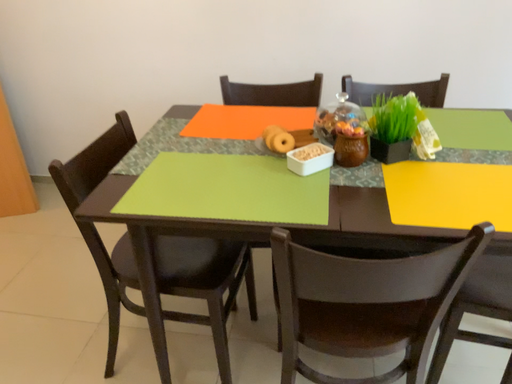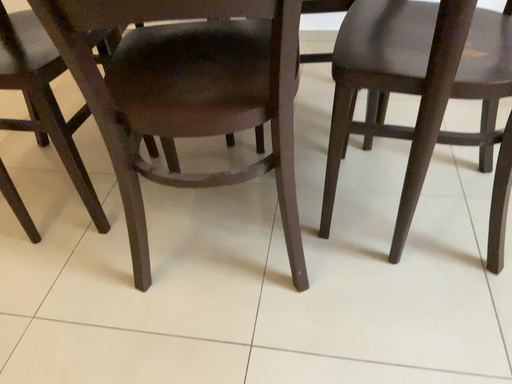
Question: How did the camera likely rotate when shooting the video?

Choices:
 (A) rotated upward
 (B) rotated downward

Answer: (B)